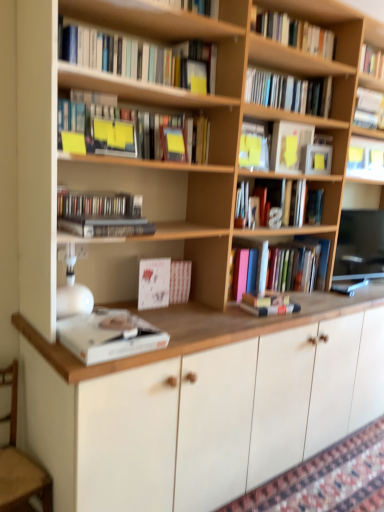
I want to click on vacant area that is situated to the right of white matte book at lower left, positioned as the 1th book in bottom-to-top order, so click(x=186, y=331).